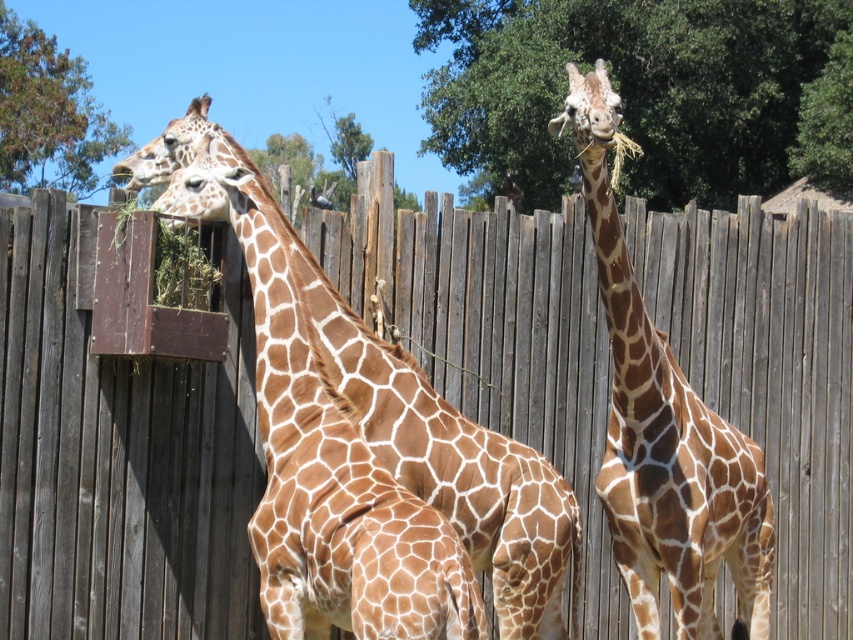
Who is more distant from viewer, [769,502] or [154,301]?

The point [769,502] is more distant.

Is brown spotted giraffe at right further to camera compared to green grass at left?

No, brown spotted giraffe at right is in front of green grass at left.

Image resolution: width=853 pixels, height=640 pixels. What do you see at coordinates (665, 433) in the screenshot? I see `brown spotted giraffe at right` at bounding box center [665, 433].

The image size is (853, 640). Identify the location of brown spotted giraffe at right. (665, 433).

Can you confirm if brown wooden fence at left is thinner than brown spotted giraffe at left?

Yes.

Is point (59, 376) closer to camera compared to point (206, 104)?

That is True.

What do you see at coordinates (119, 458) in the screenshot?
I see `brown wooden fence at left` at bounding box center [119, 458].

At what (x,y) coordinates should I click in order to perform the action: click on brown wooden fence at left. Please return your answer as a coordinate pair (x, y). The width and height of the screenshot is (853, 640). Looking at the image, I should click on (119, 458).

Consider the image. Is brown wooden fence at left thinner than brown spotted giraffe at right?

Yes, brown wooden fence at left is thinner than brown spotted giraffe at right.

Is brown wooden fence at left to the left of brown spotted giraffe at right from the viewer's perspective?

Correct, you'll find brown wooden fence at left to the left of brown spotted giraffe at right.

This screenshot has width=853, height=640. What do you see at coordinates (119, 458) in the screenshot?
I see `brown wooden fence at left` at bounding box center [119, 458].

Where is `brown wooden fence at left`? This screenshot has height=640, width=853. brown wooden fence at left is located at coordinates [x=119, y=458].